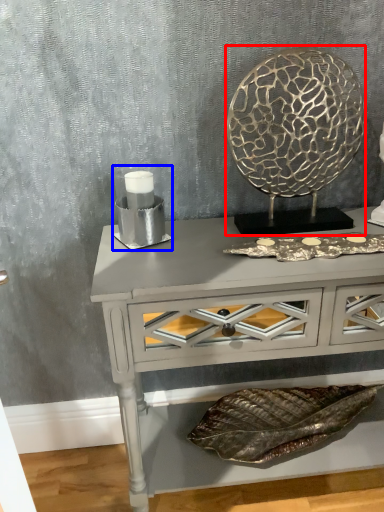
Question: Which point is further to the camera, round table (highlighted by a red box) or candle holder (highlighted by a blue box)?

Choices:
 (A) round table
 (B) candle holder

Answer: (B)